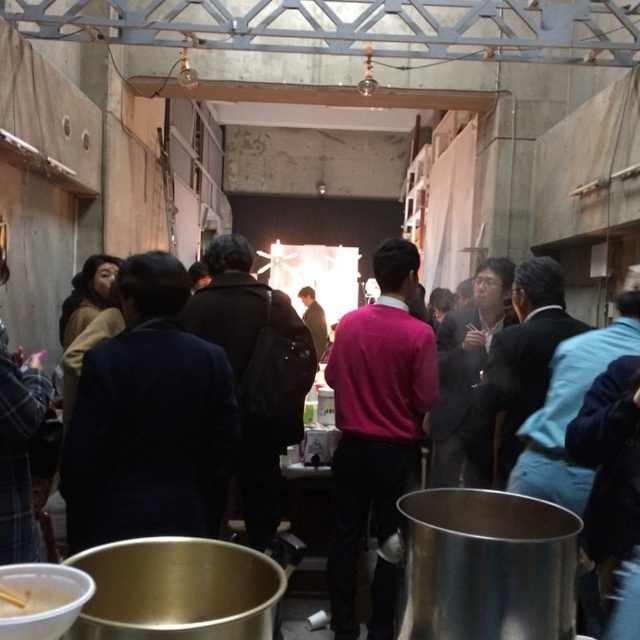
Looking at this image, can you confirm if dark blue suit at center is thinner than white matte bowl at lower left?

In fact, dark blue suit at center might be wider than white matte bowl at lower left.

Does dark blue suit at center lie behind white matte bowl at lower left?

Yes, dark blue suit at center is further from the viewer.

Measure the distance between dark blue suit at center and camera.

dark blue suit at center and camera are 2.10 meters apart.

I want to click on dark blue suit at center, so click(150, 285).